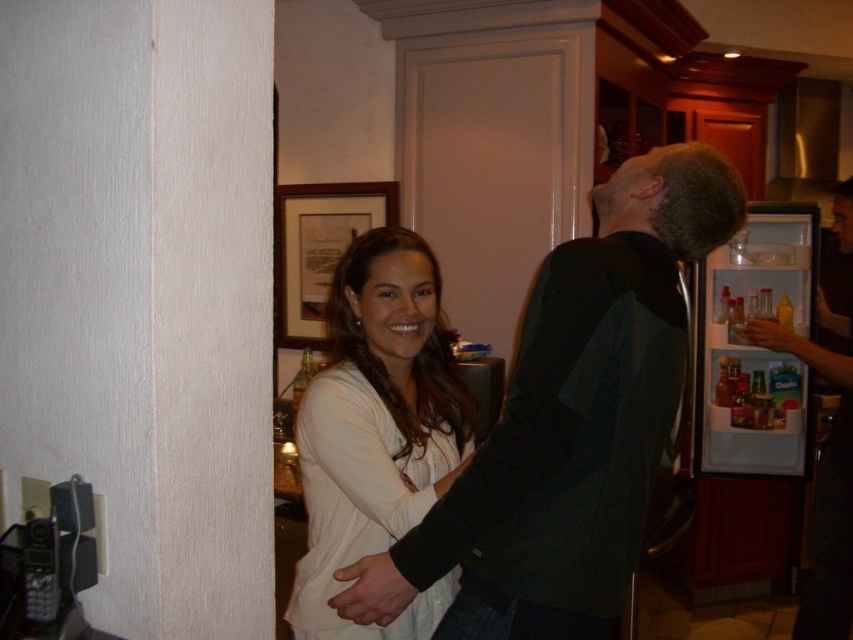
Between dark green sweater at center and wooden frame at upper center, which one appears on the right side from the viewer's perspective?

Positioned to the right is dark green sweater at center.

Can you confirm if dark green sweater at center is positioned to the right of wooden frame at upper center?

Correct, you'll find dark green sweater at center to the right of wooden frame at upper center.

Between point (613, 368) and point (363, 228), which one is positioned in front?

Point (613, 368) is more forward.

The width and height of the screenshot is (853, 640). I want to click on dark green sweater at center, so click(x=570, y=422).

Can you confirm if white matte shirt at center is thinner than dark green sweater at right?

In fact, white matte shirt at center might be wider than dark green sweater at right.

Between white matte shirt at center and dark green sweater at right, which one has more height?

dark green sweater at right

Is point (357, 547) closer to camera compared to point (820, 323)?

Yes, it is.

Find the location of a particular element. white matte shirt at center is located at coordinates (376, 429).

Can you confirm if dark green sweater at right is wider than wooden frame at upper center?

No.

Can you confirm if dark green sweater at right is positioned to the left of wooden frame at upper center?

Incorrect, dark green sweater at right is not on the left side of wooden frame at upper center.

Where is `dark green sweater at right`? Image resolution: width=853 pixels, height=640 pixels. dark green sweater at right is located at coordinates (827, 448).